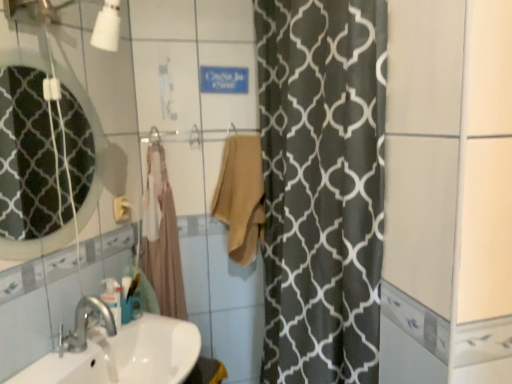
Question: Should I look upward or downward to see white glossy sink at lower left?

Choices:
 (A) up
 (B) down

Answer: (B)

Question: From the image's perspective, is beige cotton towel at center, the second bath towel in the left-to-right sequence, above beige cotton bath towel at center, marked as the 2th bath towel in a right-to-left arrangement?

Choices:
 (A) no
 (B) yes

Answer: (B)

Question: Considering the relative sizes of beige cotton towel at center, the second bath towel in the left-to-right sequence, and beige cotton bath towel at center, marked as the 2th bath towel in a right-to-left arrangement, in the image provided, is beige cotton towel at center, the second bath towel in the left-to-right sequence, wider than beige cotton bath towel at center, marked as the 2th bath towel in a right-to-left arrangement,?

Choices:
 (A) yes
 (B) no

Answer: (A)

Question: Is beige cotton towel at center, the second bath towel in the left-to-right sequence, smaller than beige cotton bath towel at center, acting as the first bath towel starting from the left?

Choices:
 (A) yes
 (B) no

Answer: (A)

Question: Could you tell me if beige cotton towel at center, the second bath towel in the left-to-right sequence, is turned towards beige cotton bath towel at center, marked as the 2th bath towel in a right-to-left arrangement?

Choices:
 (A) no
 (B) yes

Answer: (A)

Question: Can you confirm if beige cotton towel at center, which is counted as the 1th bath towel, starting from the right, is positioned to the left of beige cotton bath towel at center, marked as the 2th bath towel in a right-to-left arrangement?

Choices:
 (A) yes
 (B) no

Answer: (B)

Question: From a real-world perspective, is beige cotton towel at center, the second bath towel in the left-to-right sequence, physically above beige cotton bath towel at center, marked as the 2th bath towel in a right-to-left arrangement?

Choices:
 (A) yes
 (B) no

Answer: (A)

Question: Does matte glass mirror at upper left have a greater width compared to beige cotton towel at center, the second bath towel in the left-to-right sequence?

Choices:
 (A) no
 (B) yes

Answer: (A)

Question: From the image's perspective, is matte glass mirror at upper left under beige cotton towel at center, the second bath towel in the left-to-right sequence?

Choices:
 (A) yes
 (B) no

Answer: (B)

Question: From the image's perspective, is matte glass mirror at upper left over beige cotton towel at center, the second bath towel in the left-to-right sequence?

Choices:
 (A) yes
 (B) no

Answer: (A)

Question: Does matte glass mirror at upper left have a larger size compared to beige cotton towel at center, the second bath towel in the left-to-right sequence?

Choices:
 (A) yes
 (B) no

Answer: (B)

Question: Is matte glass mirror at upper left smaller than beige cotton towel at center, which is counted as the 1th bath towel, starting from the right?

Choices:
 (A) no
 (B) yes

Answer: (B)

Question: Is matte glass mirror at upper left far from beige cotton towel at center, the second bath towel in the left-to-right sequence?

Choices:
 (A) no
 (B) yes

Answer: (A)

Question: Is matte glass mirror at upper left located outside white glossy sink at lower left?

Choices:
 (A) yes
 (B) no

Answer: (A)